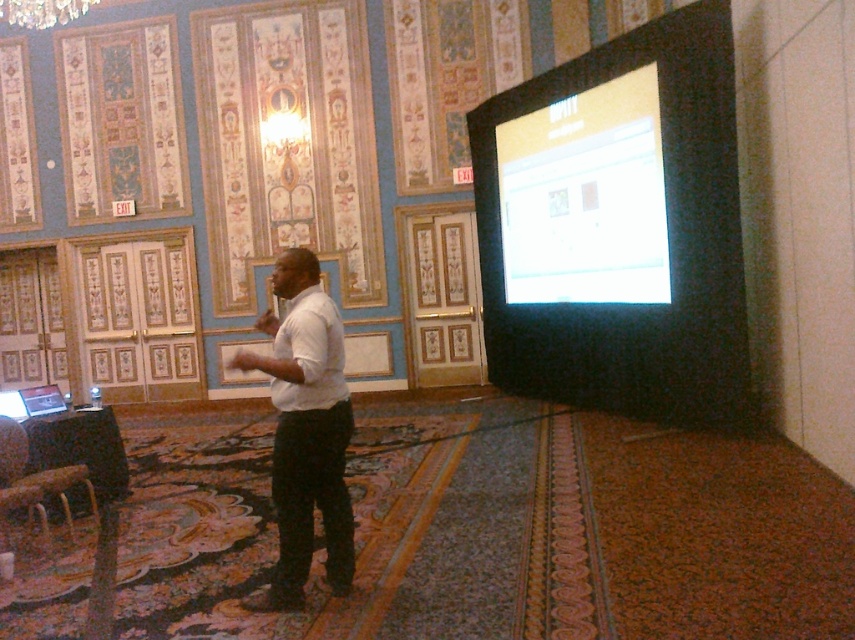
You are an event organizer setting up a presentation. You have a 12 inch wide cable that needs to connect the matte black screen at right and the white glossy screen at upper right. Will the cable be long enough to reach between them?

The distance between the matte black screen at right and the white glossy screen at upper right is 11.56 inches. Since the cable is 12 inches long, it will be long enough to connect them.

From the picture: You are standing in the conference room and see two points marked on the floor. The first point is at coordinate point (616, 120) and the second is at point (305, 282). If you are facing the front of the room, which point is closer to you?

Point (305, 282) is closer to you because it is in front of point (616, 120).

You are a stagehand in a conference room preparing for an event. You need to position a 1.5 meter wide podium between the matte black screen at right and the white matte shirt at center. Is there enough space between them to place the podium?

The distance between the matte black screen at right and the white matte shirt at center is 3.71 meters. Since the podium is 1.5 meters wide, there is sufficient space to place it between them as the distance is greater than the podium width.